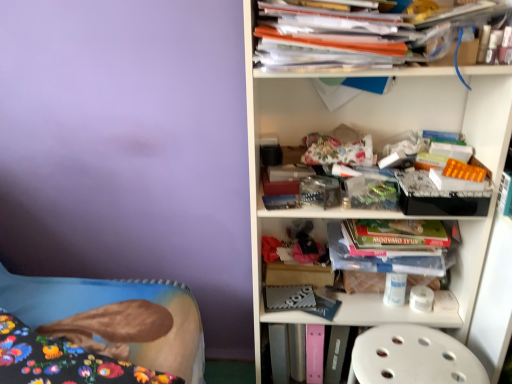
What do you see at coordinates (354, 38) in the screenshot? This screenshot has height=384, width=512. I see `orange plastic folder at upper right` at bounding box center [354, 38].

Find the location of a particular element. The width and height of the screenshot is (512, 384). purple matte wall at upper left is located at coordinates (130, 150).

The height and width of the screenshot is (384, 512). What do you see at coordinates (406, 130) in the screenshot? I see `white plastic shelf at upper right, acting as the 2th shelf starting from the bottom` at bounding box center [406, 130].

Find the location of a particular element. Image resolution: width=512 pixels, height=384 pixels. white plastic step stool at lower right is located at coordinates (412, 357).

I want to click on fluffy fabric bed at lower left, so click(x=113, y=303).

You are a GUI agent. You are given a task and a screenshot of the screen. Output one action in this format:
    pyautogui.click(x=<x>, y=<y>)
    Task: Click on the hardcover book at center, which ranks as the 2th paperback book in top-to-bottom order
    The width and height of the screenshot is (512, 384).
    Given the screenshot: What is the action you would take?
    pyautogui.click(x=279, y=353)

The width and height of the screenshot is (512, 384). What are the coordinates of `translucent plastic container at center, arranged as the 2th shelf when viewed from the top` in the screenshot? It's located at (385, 314).

Locate an element on the screen. The width and height of the screenshot is (512, 384). orange plastic folder at upper right is located at coordinates (354, 38).

Can you tell me how much translucent plastic container at center, placed as the 1th shelf when sorted from bottom to top, and white textured paperback book at center, which appears as the 2th paperback book when ordered from the bottom, differ in facing direction?

translucent plastic container at center, placed as the 1th shelf when sorted from bottom to top, and white textured paperback book at center, which appears as the 2th paperback book when ordered from the bottom, are facing 4.05e-05 degrees away from each other.

Who is more distant, translucent plastic container at center, placed as the 1th shelf when sorted from bottom to top, or white textured paperback book at center, positioned as the first paperback book in top-to-bottom order?

white textured paperback book at center, positioned as the first paperback book in top-to-bottom order.

Choose the correct answer: Is translucent plastic container at center, arranged as the 2th shelf when viewed from the top, inside white textured paperback book at center, which appears as the 2th paperback book when ordered from the bottom, or outside it?

translucent plastic container at center, arranged as the 2th shelf when viewed from the top, is located beyond the bounds of white textured paperback book at center, which appears as the 2th paperback book when ordered from the bottom.

From a real-world perspective, starting from the translucent plastic container at center, arranged as the 2th shelf when viewed from the top, which paperback book is the 1st one below it? Please provide its 2D coordinates.

[(289, 297)]

Can you see fluffy fabric bed at lower left touching purple matte wall at upper left?

fluffy fabric bed at lower left is not next to purple matte wall at upper left, and they're not touching.

In the image, is fluffy fabric bed at lower left positioned in front of or behind purple matte wall at upper left?

Clearly, fluffy fabric bed at lower left is behind purple matte wall at upper left.

From a real-world perspective, which is physically above, fluffy fabric bed at lower left or purple matte wall at upper left?

From a 3D spatial view, purple matte wall at upper left is above.

Is purple matte wall at upper left inside fluffy fabric bed at lower left?

Actually, purple matte wall at upper left is outside fluffy fabric bed at lower left.

Which is nearer, (310,289) or (267,58)?

The point (267,58) is in front.

From a real-world perspective, who is located lower, white textured paperback book at center, positioned as the first paperback book in top-to-bottom order, or orange plastic folder at upper right?

white textured paperback book at center, positioned as the first paperback book in top-to-bottom order.

Is white textured paperback book at center, which appears as the 2th paperback book when ordered from the bottom, at the left side of orange plastic folder at upper right?

Yes.

From a real-world perspective, which is physically above, white plastic step stool at lower right or hardcover book at center, which ranks as the 2th paperback book in top-to-bottom order?

In real-world perspective, white plastic step stool at lower right is above.

Is hardcover book at center, placed as the first paperback book when sorted from bottom to top, at the back of white plastic step stool at lower right?

No, white plastic step stool at lower right is not facing the opposite direction of hardcover book at center, placed as the first paperback book when sorted from bottom to top.

Is white plastic step stool at lower right positioned far away from hardcover book at center, which ranks as the 2th paperback book in top-to-bottom order?

That's not correct — white plastic step stool at lower right is a little close to hardcover book at center, which ranks as the 2th paperback book in top-to-bottom order.

Identify the location of the 2nd paperback book behind the white plastic step stool at lower right. This screenshot has height=384, width=512. (279, 353).

Does white plastic shelf at upper right, acting as the 2th shelf starting from the bottom, turn towards orange plastic folder at upper right?

Yes, white plastic shelf at upper right, acting as the 2th shelf starting from the bottom, is turned towards orange plastic folder at upper right.

This screenshot has width=512, height=384. I want to click on book that is above the white plastic shelf at upper right, acting as the 2th shelf starting from the bottom (from the image's perspective), so click(x=354, y=38).

Is white plastic shelf at upper right, acting as the 2th shelf starting from the bottom, shorter than orange plastic folder at upper right?

No.

Consider the image. From the image's perspective, is white plastic shelf at upper right, which ranks as the first shelf in top-to-bottom order, located above or below orange plastic folder at upper right?

Clearly, from the image's perspective, white plastic shelf at upper right, which ranks as the first shelf in top-to-bottom order, is below orange plastic folder at upper right.

Is white textured paperback book at center, which appears as the 2th paperback book when ordered from the bottom, far from hardcover book at center, placed as the first paperback book when sorted from bottom to top?

No.

Considering the sizes of objects white textured paperback book at center, which appears as the 2th paperback book when ordered from the bottom, and hardcover book at center, which ranks as the 2th paperback book in top-to-bottom order, in the image provided, who is thinner, white textured paperback book at center, which appears as the 2th paperback book when ordered from the bottom, or hardcover book at center, which ranks as the 2th paperback book in top-to-bottom order,?

Thinner between the two is white textured paperback book at center, which appears as the 2th paperback book when ordered from the bottom.

Could you measure the distance between white textured paperback book at center, positioned as the first paperback book in top-to-bottom order, and hardcover book at center, placed as the first paperback book when sorted from bottom to top?

They are 5.07 inches apart.

Considering the points (301, 295) and (271, 338), which point is behind, point (301, 295) or point (271, 338)?

The point (301, 295) is behind.

From the image's perspective, does hardcover book at center, which ranks as the 2th paperback book in top-to-bottom order, appear higher than purple matte wall at upper left?

No.

Is point (275, 341) in front of point (169, 127)?

Yes, point (275, 341) is closer to viewer.

Is purple matte wall at upper left at the back of hardcover book at center, which ranks as the 2th paperback book in top-to-bottom order?

hardcover book at center, which ranks as the 2th paperback book in top-to-bottom order, does not have its back to purple matte wall at upper left.

At what (x,y) coordinates should I click in order to perform the action: click on the 1st paperback book behind the translucent plastic container at center, arranged as the 2th shelf when viewed from the top. Please return your answer as a coordinate pair (x, y). The image size is (512, 384). Looking at the image, I should click on (289, 297).

Identify the location of backdrop on the left of fluffy fabric bed at lower left. The height and width of the screenshot is (384, 512). (130, 150).

Based on their spatial positions, is translucent plastic container at center, arranged as the 2th shelf when viewed from the top, or white plastic step stool at lower right further from white plastic shelf at upper right, which ranks as the first shelf in top-to-bottom order?

white plastic step stool at lower right is positioned further to the anchor white plastic shelf at upper right, which ranks as the first shelf in top-to-bottom order.

Estimate the real-world distances between objects in this image. Which object is further from orange plastic folder at upper right, purple matte wall at upper left or translucent plastic container at center, placed as the 1th shelf when sorted from bottom to top?

purple matte wall at upper left.

Estimate the real-world distances between objects in this image. Which object is further from white plastic shelf at upper right, acting as the 2th shelf starting from the bottom, orange plastic folder at upper right or white textured paperback book at center, positioned as the first paperback book in top-to-bottom order?

Among the two, white textured paperback book at center, positioned as the first paperback book in top-to-bottom order, is located further to white plastic shelf at upper right, acting as the 2th shelf starting from the bottom.

Estimate the real-world distances between objects in this image. Which object is further from purple matte wall at upper left, white plastic shelf at upper right, acting as the 2th shelf starting from the bottom, or orange plastic folder at upper right?

Among the two, orange plastic folder at upper right is located further to purple matte wall at upper left.

Considering their positions, is orange plastic folder at upper right positioned further to white plastic step stool at lower right than hardcover book at center, which ranks as the 2th paperback book in top-to-bottom order?

Based on the image, orange plastic folder at upper right appears to be further to white plastic step stool at lower right.

Based on their spatial positions, is orange plastic folder at upper right or hardcover book at center, placed as the first paperback book when sorted from bottom to top, further from white plastic shelf at upper right, which ranks as the first shelf in top-to-bottom order?

Based on the image, hardcover book at center, placed as the first paperback book when sorted from bottom to top, appears to be further to white plastic shelf at upper right, which ranks as the first shelf in top-to-bottom order.

Which object lies nearer to the anchor point fluffy fabric bed at lower left, translucent plastic container at center, arranged as the 2th shelf when viewed from the top, or orange plastic folder at upper right?

Among the two, translucent plastic container at center, arranged as the 2th shelf when viewed from the top, is located nearer to fluffy fabric bed at lower left.

Looking at this image, from the image, which object appears to be farther from white plastic shelf at upper right, which ranks as the first shelf in top-to-bottom order, hardcover book at center, which ranks as the 2th paperback book in top-to-bottom order, or fluffy fabric bed at lower left?

Among the two, fluffy fabric bed at lower left is located further to white plastic shelf at upper right, which ranks as the first shelf in top-to-bottom order.

This screenshot has height=384, width=512. Identify the location of shelf that lies between orange plastic folder at upper right and translucent plastic container at center, placed as the 1th shelf when sorted from bottom to top, from top to bottom. (406, 130).

The height and width of the screenshot is (384, 512). What are the coordinates of `shelf positioned between white plastic shelf at upper right, acting as the 2th shelf starting from the bottom, and white textured paperback book at center, positioned as the first paperback book in top-to-bottom order, from near to far` in the screenshot? It's located at (385, 314).

Find the location of `backdrop between orange plastic folder at upper right and hardcover book at center, placed as the first paperback book when sorted from bottom to top, vertically`. backdrop between orange plastic folder at upper right and hardcover book at center, placed as the first paperback book when sorted from bottom to top, vertically is located at coordinates (130, 150).

Identify the location of backdrop between orange plastic folder at upper right and white plastic step stool at lower right in the up-down direction. (130, 150).